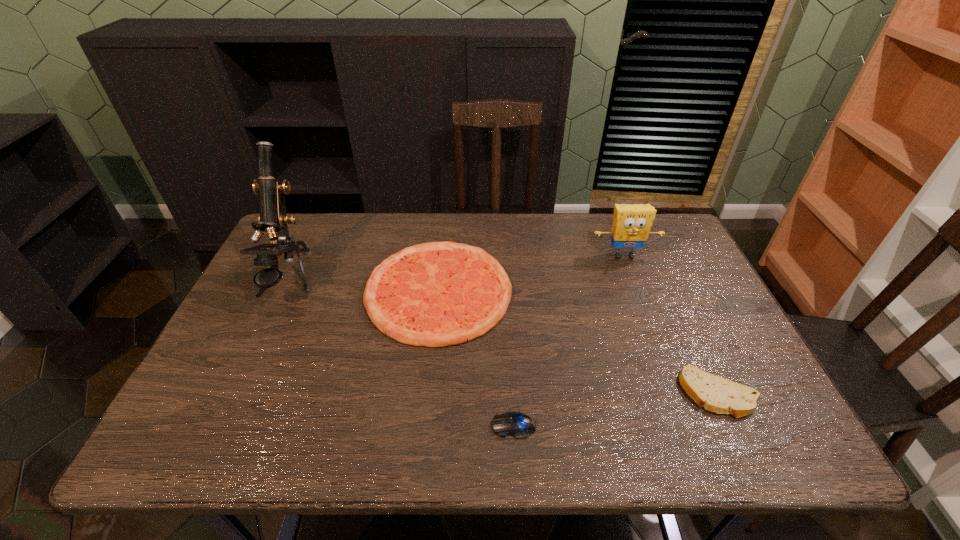
Find the location of a particular element. vacant space that is in between the computer mouse and the pizza is located at coordinates (476, 359).

The width and height of the screenshot is (960, 540). Find the location of `free space between the pizza and the leftmost object`. free space between the pizza and the leftmost object is located at coordinates (364, 285).

This screenshot has width=960, height=540. Find the location of `free space between the pizza and the pita bread`. free space between the pizza and the pita bread is located at coordinates (578, 342).

Locate an element on the screen. Image resolution: width=960 pixels, height=540 pixels. free space between the sponge and the pita bread is located at coordinates (671, 325).

Image resolution: width=960 pixels, height=540 pixels. Identify the location of vacant region between the computer mouse and the third shortest object. (476, 359).

You are a GUI agent. You are given a task and a screenshot of the screen. Output one action in this format:
    pyautogui.click(x=<x>, y=<y>)
    Task: Click on the unoccupied area between the tallest object and the computer mouse
    The image size is (960, 540).
    Given the screenshot: What is the action you would take?
    pyautogui.click(x=401, y=353)

In order to click on free space between the pizza and the pita bread in this screenshot , I will do `click(578, 342)`.

Find the location of `empty location between the computer mouse and the pizza`. empty location between the computer mouse and the pizza is located at coordinates (476, 359).

Locate which object is the second closest to the microscope. Please provide its 2D coordinates. Your answer should be formatted as a tuple, i.e. [(x, y)], where the tuple contains the x and y coordinates of a point satisfying the conditions above.

[(519, 425)]

Find the location of a particular element. object that is the fourth nearest to the pita bread is located at coordinates (272, 219).